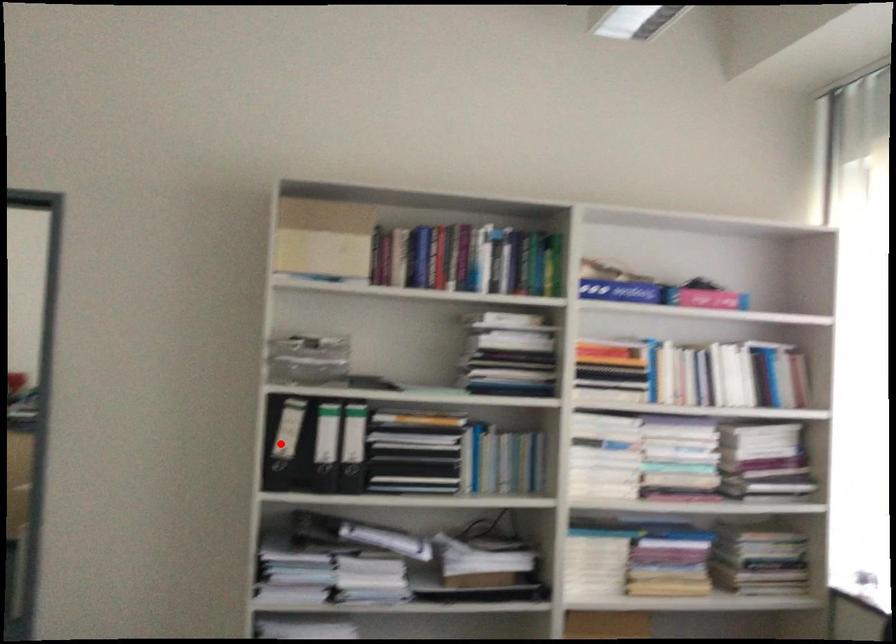
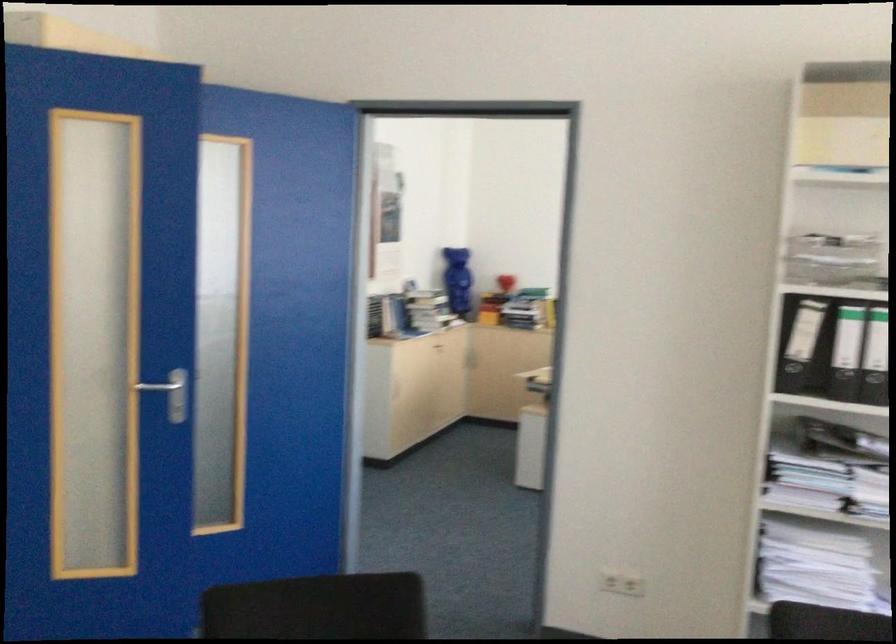
The point at the highlighted location is marked in the first image. Where is the corresponding point in the second image?

(797, 343)